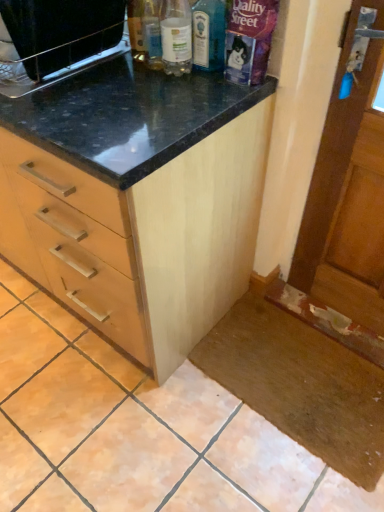
This screenshot has height=512, width=384. In order to click on free space to the left of clear plastic bottle at upper center, the second bottle positioned from the right in this screenshot , I will do `click(118, 79)`.